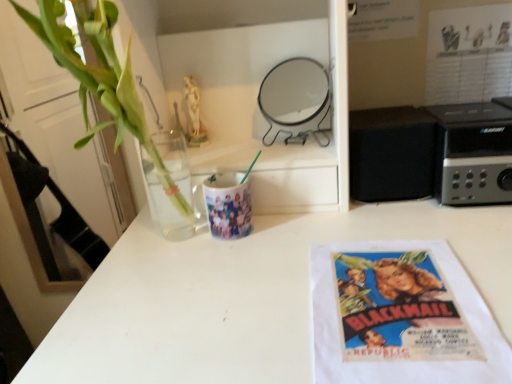
Describe the element at coordinates (296, 101) in the screenshot. This screenshot has width=512, height=384. I see `metallic round mirror at upper center, which is counted as the 1th appliance, starting from the left` at that location.

Image resolution: width=512 pixels, height=384 pixels. What do you see at coordinates (473, 153) in the screenshot?
I see `black plastic stereo at right, arranged as the third appliance when viewed from the left` at bounding box center [473, 153].

Find the location of a particular element. vintage paper poster at upper right is located at coordinates (469, 54).

This screenshot has width=512, height=384. I want to click on black matte speaker at right, which ranks as the 2th appliance in left-to-right order, so click(391, 153).

This screenshot has height=384, width=512. Find the location of `green leafy plant at left`. green leafy plant at left is located at coordinates (103, 81).

You are a GUI agent. You are given a task and a screenshot of the screen. Output one action in this format:
    pyautogui.click(x=<x>, y=<y>)
    Task: Click on the white paper towel at lower right
    
    Given the screenshot: What is the action you would take?
    pyautogui.click(x=401, y=317)

In order to click on metallic round mirror at upper center, which is counted as the 1th appliance, starting from the left in this screenshot , I will do `click(296, 101)`.

Consider the image. Between white paper towel at lower right and black plastic stereo at right, the first appliance when ordered from right to left, which one has less height?

Standing shorter between the two is white paper towel at lower right.

Is the depth of white paper towel at lower right less than that of black plastic stereo at right, arranged as the third appliance when viewed from the left?

Yes, it is.

Does point (392, 255) lie in front of point (446, 190)?

Yes, it is.

Would you say black plastic stereo at right, the first appliance when ordered from right to left, is part of white paper towel at lower right's contents?

Definitely not — black plastic stereo at right, the first appliance when ordered from right to left, is not inside white paper towel at lower right.

Are matte ceramic mug at center and black plastic stereo at right, the first appliance when ordered from right to left, making contact?

matte ceramic mug at center and black plastic stereo at right, the first appliance when ordered from right to left, are not in contact.

I want to click on mug on the left of black plastic stereo at right, arranged as the third appliance when viewed from the left, so click(228, 205).

Looking at this image, considering the relative positions of matte ceramic mug at center and black plastic stereo at right, arranged as the third appliance when viewed from the left, in the image provided, is matte ceramic mug at center to the right of black plastic stereo at right, arranged as the third appliance when viewed from the left, from the viewer's perspective?

In fact, matte ceramic mug at center is to the left of black plastic stereo at right, arranged as the third appliance when viewed from the left.

From a real-world perspective, is matte ceramic mug at center over black plastic stereo at right, arranged as the third appliance when viewed from the left?

No, from a real-world perspective, matte ceramic mug at center is not on top of black plastic stereo at right, arranged as the third appliance when viewed from the left.

Consider the image. From a real-world perspective, relative to black matte speaker at right, the second appliance positioned from the right, is black plastic stereo at right, the first appliance when ordered from right to left, vertically above or below?

In terms of real-world spatial position, black plastic stereo at right, the first appliance when ordered from right to left, is below black matte speaker at right, the second appliance positioned from the right.

Is black plastic stereo at right, arranged as the third appliance when viewed from the left, oriented towards black matte speaker at right, the second appliance positioned from the right?

No, black plastic stereo at right, arranged as the third appliance when viewed from the left, is not aimed at black matte speaker at right, the second appliance positioned from the right.

Does black plastic stereo at right, the first appliance when ordered from right to left, come in front of black matte speaker at right, the second appliance positioned from the right?

That is True.

Locate an element on the screen. The image size is (512, 384). appliance below the black matte speaker at right, the second appliance positioned from the right (from the image's perspective) is located at coordinates (473, 153).

Considering the sizes of objects green leafy plant at left and vintage paper poster at upper right in the image provided, who is taller, green leafy plant at left or vintage paper poster at upper right?

green leafy plant at left is taller.

Is there a large distance between green leafy plant at left and vintage paper poster at upper right?

Actually, green leafy plant at left and vintage paper poster at upper right are a little close together.

Is green leafy plant at left positioned beyond the bounds of vintage paper poster at upper right?

Yes, green leafy plant at left is outside of vintage paper poster at upper right.

Is white paper towel at lower right at the right side of matte ceramic mug at center?

Yes, white paper towel at lower right is to the right of matte ceramic mug at center.

How many degrees apart are the facing directions of white paper towel at lower right and matte ceramic mug at center?

white paper towel at lower right and matte ceramic mug at center are facing 0.698 degrees away from each other.

From a real-world perspective, relative to matte ceramic mug at center, is white paper towel at lower right vertically above or below?

In terms of real-world spatial position, white paper towel at lower right is below matte ceramic mug at center.

Could you tell me if white paper towel at lower right is turned towards matte ceramic mug at center?

No, white paper towel at lower right is not facing towards matte ceramic mug at center.

Which of these two, white paper towel at lower right or metallic round mirror at upper center, the third appliance from the right, is smaller?

With smaller size is white paper towel at lower right.

The width and height of the screenshot is (512, 384). I want to click on paperback book below the metallic round mirror at upper center, the third appliance from the right (from the image's perspective), so click(x=401, y=317).

Which object is wider, white paper towel at lower right or metallic round mirror at upper center, the third appliance from the right?

white paper towel at lower right.

Considering the sizes of objects white paper towel at lower right and metallic round mirror at upper center, which is counted as the 1th appliance, starting from the left, in the image provided, who is shorter, white paper towel at lower right or metallic round mirror at upper center, which is counted as the 1th appliance, starting from the left,?

white paper towel at lower right is shorter.

Is vintage paper poster at upper right to the right of matte ceramic mug at center from the viewer's perspective?

Correct, you'll find vintage paper poster at upper right to the right of matte ceramic mug at center.

From a real-world perspective, who is located lower, vintage paper poster at upper right or matte ceramic mug at center?

matte ceramic mug at center.

Is point (438, 83) positioned behind point (215, 236)?

Yes, it is behind point (215, 236).

Is vintage paper poster at upper right directly adjacent to matte ceramic mug at center?

vintage paper poster at upper right and matte ceramic mug at center are not in contact.

The width and height of the screenshot is (512, 384). In the image, there is a black plastic stereo at right, arranged as the third appliance when viewed from the left. Identify the location of paperback book below it (from the image's perspective). (401, 317).

Locate an element on the screen. mug that appears below the black plastic stereo at right, arranged as the third appliance when viewed from the left (from a real-world perspective) is located at coordinates (228, 205).

Based on their spatial positions, is vintage paper poster at upper right or black matte speaker at right, which ranks as the 2th appliance in left-to-right order, closer to white paper towel at lower right?

black matte speaker at right, which ranks as the 2th appliance in left-to-right order, is positioned closer to the anchor white paper towel at lower right.

When comparing their distances from white paper towel at lower right, does black plastic stereo at right, the first appliance when ordered from right to left, or vintage paper poster at upper right seem further?

vintage paper poster at upper right is positioned further to the anchor white paper towel at lower right.

Estimate the real-world distances between objects in this image. Which object is closer to matte ceramic mug at center, white paper towel at lower right or black matte speaker at right, the second appliance positioned from the right?

Based on the image, black matte speaker at right, the second appliance positioned from the right, appears to be nearer to matte ceramic mug at center.

Looking at the image, which one is located further to vintage paper poster at upper right, green leafy plant at left or black plastic stereo at right, the first appliance when ordered from right to left?

green leafy plant at left is positioned further to the anchor vintage paper poster at upper right.

Which object lies further to the anchor point green leafy plant at left, black plastic stereo at right, arranged as the third appliance when viewed from the left, or vintage paper poster at upper right?

vintage paper poster at upper right is positioned further to the anchor green leafy plant at left.

Based on their spatial positions, is black matte speaker at right, the second appliance positioned from the right, or white paper towel at lower right further from vintage paper poster at upper right?

white paper towel at lower right.

From the image, which object appears to be farther from metallic round mirror at upper center, the third appliance from the right, green leafy plant at left or matte ceramic mug at center?

green leafy plant at left is further to metallic round mirror at upper center, the third appliance from the right.

Which object lies nearer to the anchor point metallic round mirror at upper center, which is counted as the 1th appliance, starting from the left, white paper towel at lower right or black plastic stereo at right, the first appliance when ordered from right to left?

black plastic stereo at right, the first appliance when ordered from right to left.

The height and width of the screenshot is (384, 512). What are the coordinates of `paperback book between green leafy plant at left and vintage paper poster at upper right in the horizontal direction` in the screenshot? It's located at (401, 317).

Where is `mug between white paper towel at lower right and metallic round mirror at upper center, which is counted as the 1th appliance, starting from the left, from front to back`? The width and height of the screenshot is (512, 384). mug between white paper towel at lower right and metallic round mirror at upper center, which is counted as the 1th appliance, starting from the left, from front to back is located at coordinates (228, 205).

The image size is (512, 384). I want to click on appliance located between metallic round mirror at upper center, which is counted as the 1th appliance, starting from the left, and black plastic stereo at right, arranged as the third appliance when viewed from the left, in the left-right direction, so click(391, 153).

Where is `appliance between white paper towel at lower right and black matte speaker at right, the second appliance positioned from the right, from front to back`? This screenshot has height=384, width=512. appliance between white paper towel at lower right and black matte speaker at right, the second appliance positioned from the right, from front to back is located at coordinates (473, 153).